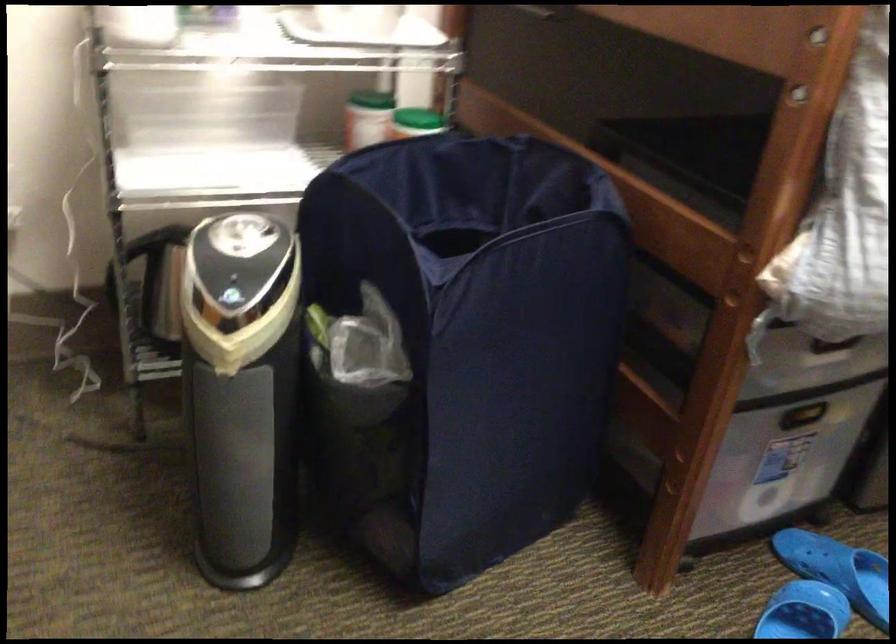
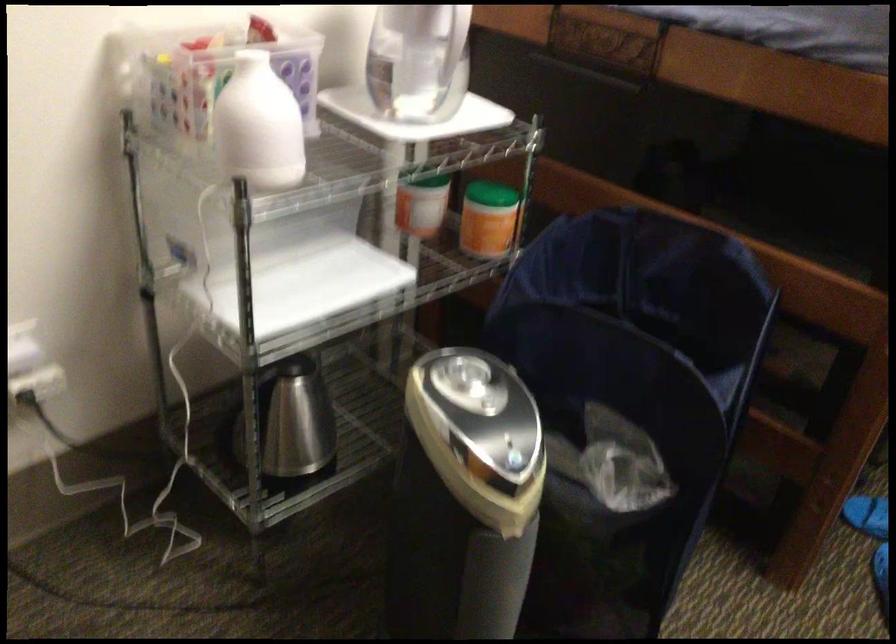
Question: Which direction would the cameraman need to move to produce the second image? Reply with the corresponding letter.

Choices:
 (A) Left
 (B) Right
 (C) Forward
 (D) Backward

Answer: (A)